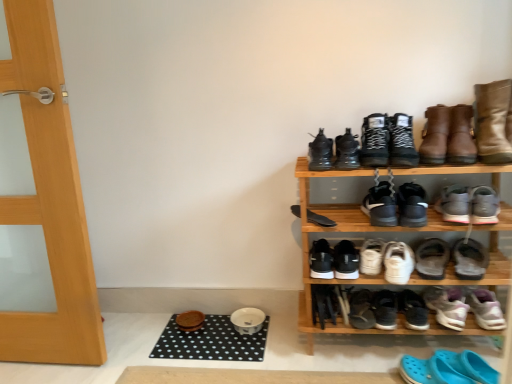
This screenshot has width=512, height=384. Identify the location of vacant space in between wooden shoe rack at upper right and wooden door at left. (210, 343).